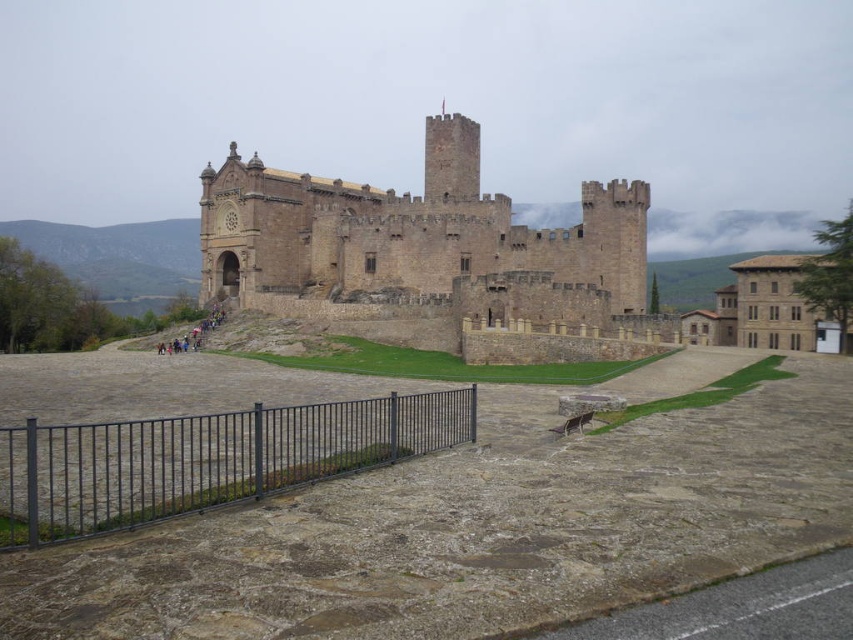
Question: Is brown stone castle at center wider than black metal fence at lower left?

Choices:
 (A) no
 (B) yes

Answer: (B)

Question: Does brown stone castle at center have a lesser width compared to black metal fence at lower left?

Choices:
 (A) yes
 (B) no

Answer: (B)

Question: Among these objects, which one is nearest to the camera?

Choices:
 (A) black metal fence at lower left
 (B) brown stone castle at center

Answer: (A)

Question: Observing the image, what is the correct spatial positioning of brown stone castle at center in reference to black metal fence at lower left?

Choices:
 (A) above
 (B) below

Answer: (A)